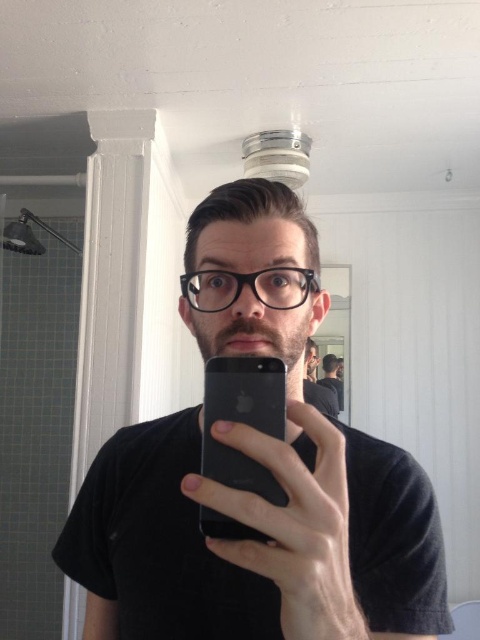
Between matte black phone at center and black matte smartphone at center, which one has more height?

matte black phone at center is taller.

Describe the element at coordinates (263, 461) in the screenshot. I see `matte black phone at center` at that location.

Is point (332, 518) less distant than point (235, 397)?

Yes, it is in front of point (235, 397).

The height and width of the screenshot is (640, 480). Identify the location of matte black phone at center. (263, 461).

Is point (240, 384) behind point (338, 369)?

No, (240, 384) is in front of (338, 369).

What do you see at coordinates (242, 420) in the screenshot?
I see `black matte smartphone at center` at bounding box center [242, 420].

Where is `black matte smartphone at center`? This screenshot has height=640, width=480. black matte smartphone at center is located at coordinates (242, 420).

Is matte black phone at center to the left of black matte shirt at center from the viewer's perspective?

Yes, matte black phone at center is to the left of black matte shirt at center.

Does matte black phone at center have a lesser height compared to black matte shirt at center?

Incorrect, matte black phone at center's height does not fall short of black matte shirt at center's.

This screenshot has height=640, width=480. Identify the location of matte black phone at center. (263, 461).

Locate an element on the screen. The width and height of the screenshot is (480, 640). matte black phone at center is located at coordinates (263, 461).